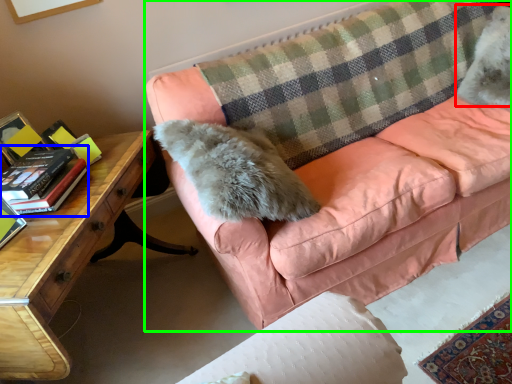
Question: Which object is the farthest from animal (highlighted by a red box)? Choose among these: paperback book (highlighted by a blue box) or studio couch (highlighted by a green box).

Choices:
 (A) paperback book
 (B) studio couch

Answer: (A)